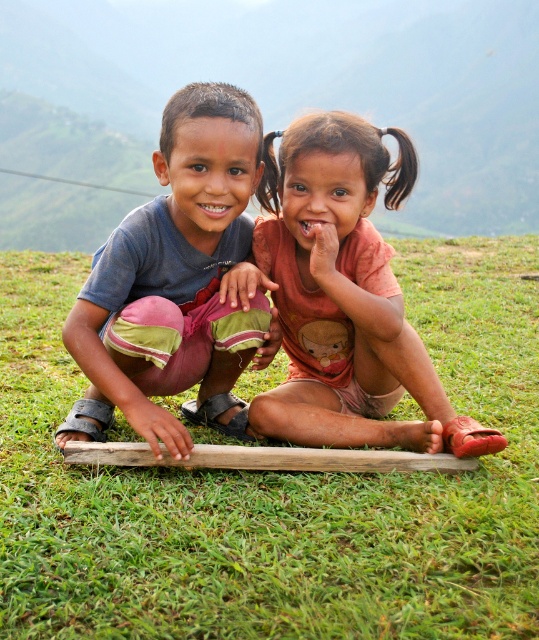
Which of these two, green grass at lower center or matte blue shirt at center, stands taller?

With more height is green grass at lower center.

Who is more distant from viewer, [63,196] or [183,188]?

Point [63,196]

At what (x,y) coordinates should I click in order to perform the action: click on green grass at lower center. Please return your answer as a coordinate pair (x, y). This screenshot has height=640, width=539. Looking at the image, I should click on (286, 88).

Identify the location of green grassy at center. (279, 490).

How far apart are green grassy at center and matte blue shirt at center?

They are 30.06 inches apart.

Does point (13, 556) come in front of point (210, 228)?

Yes, point (13, 556) is closer to viewer.

You are a GUI agent. You are given a task and a screenshot of the screen. Output one action in this format:
    pyautogui.click(x=<x>, y=<y>)
    Task: Click on the green grassy at center
    This screenshot has width=539, height=640.
    Given the screenshot: What is the action you would take?
    pyautogui.click(x=279, y=490)

Which is more to the right, green grassy at center or green grass at lower center?

green grass at lower center

Can you confirm if green grassy at center is positioned above green grass at lower center?

Actually, green grassy at center is below green grass at lower center.

Is point (503, 508) farther from viewer compared to point (38, 198)?

No, it is not.

Find the location of a particular element. The width and height of the screenshot is (539, 640). green grassy at center is located at coordinates (279, 490).